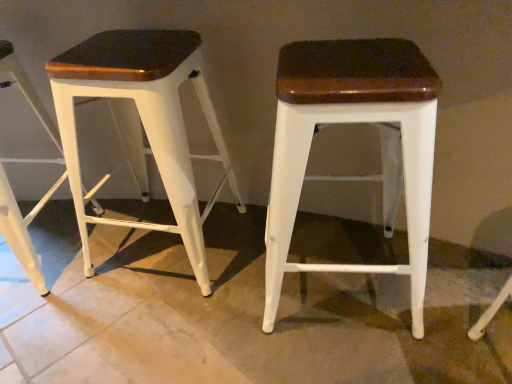
Measure the distance between matte white stool at left, which is the 1th stool from left to right, and camera.

matte white stool at left, which is the 1th stool from left to right, and camera are 3.71 feet apart.

Find the location of a particular element. Image resolution: width=512 pixels, height=384 pixels. matte white stool at center, positioned as the first stool in right-to-left order is located at coordinates (347, 123).

Can you confirm if matte white stool at left, marked as the third stool in a right-to-left arrangement, is wider than matte white stool at left, which is the second stool from right to left?

Indeed, matte white stool at left, marked as the third stool in a right-to-left arrangement, has a greater width compared to matte white stool at left, which is the second stool from right to left.

Consider the image. Considering the positions of objects matte white stool at left, marked as the third stool in a right-to-left arrangement, and matte white stool at left, which is counted as the 2th stool, starting from the left, in the image provided, who is more to the left, matte white stool at left, marked as the third stool in a right-to-left arrangement, or matte white stool at left, which is counted as the 2th stool, starting from the left,?

matte white stool at left, marked as the third stool in a right-to-left arrangement.

From a real-world perspective, is matte white stool at left, which is the 1th stool from left to right, physically above matte white stool at left, which is the second stool from right to left?

Actually, matte white stool at left, which is the 1th stool from left to right, is physically below matte white stool at left, which is the second stool from right to left, in the real world.

Consider the image. Are matte white stool at left, which is the 1th stool from left to right, and matte white stool at left, which is counted as the 2th stool, starting from the left, far apart?

They are positioned close to each other.

From the picture: Considering the sizes of objects matte white stool at center, the third stool when ordered from left to right, and matte white stool at left, which is counted as the 2th stool, starting from the left, in the image provided, who is bigger, matte white stool at center, the third stool when ordered from left to right, or matte white stool at left, which is counted as the 2th stool, starting from the left,?

matte white stool at center, the third stool when ordered from left to right, is bigger.

Could you tell me if matte white stool at center, positioned as the first stool in right-to-left order, is turned towards matte white stool at left, which is the second stool from right to left?

No, matte white stool at center, positioned as the first stool in right-to-left order, is not turned towards matte white stool at left, which is the second stool from right to left.

How many degrees apart are the facing directions of matte white stool at center, the third stool when ordered from left to right, and matte white stool at left, which is counted as the 2th stool, starting from the left?

9.35 degrees separate the facing orientations of matte white stool at center, the third stool when ordered from left to right, and matte white stool at left, which is counted as the 2th stool, starting from the left.

Considering the positions of objects matte white stool at left, which is the 1th stool from left to right, and matte white stool at center, the third stool when ordered from left to right, in the image provided, who is more to the left, matte white stool at left, which is the 1th stool from left to right, or matte white stool at center, the third stool when ordered from left to right,?

matte white stool at left, which is the 1th stool from left to right, is more to the left.

Does point (18, 230) come closer to viewer compared to point (305, 170)?

No, it is not.

Can you confirm if matte white stool at left, which is the 1th stool from left to right, is taller than matte white stool at center, positioned as the first stool in right-to-left order?

Yes.

From the image's perspective, which one is positioned higher, matte white stool at left, which is the 1th stool from left to right, or matte white stool at center, the third stool when ordered from left to right?

From the image's view, matte white stool at left, which is the 1th stool from left to right, is above.

You are a GUI agent. You are given a task and a screenshot of the screen. Output one action in this format:
    pyautogui.click(x=<x>, y=<y>)
    Task: Click on the 1st stool below when counting from the matte white stool at left, which is the second stool from right to left (from the image's perspective)
    The height and width of the screenshot is (384, 512).
    Given the screenshot: What is the action you would take?
    pyautogui.click(x=24, y=162)

Which object is positioned more to the right, matte white stool at left, which is the second stool from right to left, or matte white stool at left, marked as the third stool in a right-to-left arrangement?

matte white stool at left, which is the second stool from right to left.

Does matte white stool at left, which is the second stool from right to left, have a lesser height compared to matte white stool at left, which is the 1th stool from left to right?

In fact, matte white stool at left, which is the second stool from right to left, may be taller than matte white stool at left, which is the 1th stool from left to right.

Are matte white stool at center, positioned as the first stool in right-to-left order, and matte white stool at left, which is the 1th stool from left to right, making contact?

No, matte white stool at center, positioned as the first stool in right-to-left order, is not touching matte white stool at left, which is the 1th stool from left to right.

From the image's perspective, is matte white stool at center, the third stool when ordered from left to right, above or below matte white stool at left, which is the 1th stool from left to right?

Based on their image positions, matte white stool at center, the third stool when ordered from left to right, is located beneath matte white stool at left, which is the 1th stool from left to right.

From a real-world perspective, is matte white stool at center, the third stool when ordered from left to right, physically located above or below matte white stool at left, marked as the third stool in a right-to-left arrangement?

matte white stool at center, the third stool when ordered from left to right, is below matte white stool at left, marked as the third stool in a right-to-left arrangement.

Locate an element on the screen. stool located underneath the matte white stool at left, marked as the third stool in a right-to-left arrangement (from a real-world perspective) is located at coordinates (347, 123).

Is matte white stool at left, which is counted as the 2th stool, starting from the left, not within matte white stool at center, the third stool when ordered from left to right?

That's correct, matte white stool at left, which is counted as the 2th stool, starting from the left, is outside of matte white stool at center, the third stool when ordered from left to right.

Does point (181, 201) come in front of point (316, 46)?

That is False.

Who is shorter, matte white stool at left, which is counted as the 2th stool, starting from the left, or matte white stool at center, positioned as the first stool in right-to-left order?

With less height is matte white stool at center, positioned as the first stool in right-to-left order.

Could you tell me if matte white stool at left, which is counted as the 2th stool, starting from the left, is facing matte white stool at center, the third stool when ordered from left to right?

No, matte white stool at left, which is counted as the 2th stool, starting from the left, is not oriented towards matte white stool at center, the third stool when ordered from left to right.

You are a GUI agent. You are given a task and a screenshot of the screen. Output one action in this format:
    pyautogui.click(x=<x>, y=<y>)
    Task: Click on the stool that appears on the left of matte white stool at left, which is counted as the 2th stool, starting from the left
    The width and height of the screenshot is (512, 384).
    Given the screenshot: What is the action you would take?
    pyautogui.click(x=24, y=162)

Image resolution: width=512 pixels, height=384 pixels. In order to click on stool located on the right of matte white stool at left, which is the second stool from right to left in this screenshot , I will do `click(347, 123)`.

Looking at this image, looking at the image, which one is located further to matte white stool at left, marked as the third stool in a right-to-left arrangement, matte white stool at center, positioned as the first stool in right-to-left order, or matte white stool at left, which is the second stool from right to left?

Among the two, matte white stool at center, positioned as the first stool in right-to-left order, is located further to matte white stool at left, marked as the third stool in a right-to-left arrangement.

Estimate the real-world distances between objects in this image. Which object is further from matte white stool at center, the third stool when ordered from left to right, matte white stool at left, which is counted as the 2th stool, starting from the left, or matte white stool at left, marked as the third stool in a right-to-left arrangement?

matte white stool at left, marked as the third stool in a right-to-left arrangement, lies further to matte white stool at center, the third stool when ordered from left to right, than the other object.

In the scene shown: Looking at the image, which one is located further to matte white stool at left, marked as the third stool in a right-to-left arrangement, matte white stool at left, which is counted as the 2th stool, starting from the left, or matte white stool at center, positioned as the first stool in right-to-left order?

matte white stool at center, positioned as the first stool in right-to-left order, is further to matte white stool at left, marked as the third stool in a right-to-left arrangement.

From the image, which object appears to be farther from matte white stool at left, which is the second stool from right to left, matte white stool at left, marked as the third stool in a right-to-left arrangement, or matte white stool at center, the third stool when ordered from left to right?

matte white stool at center, the third stool when ordered from left to right, is further to matte white stool at left, which is the second stool from right to left.

When comparing their distances from matte white stool at center, the third stool when ordered from left to right, does matte white stool at left, marked as the third stool in a right-to-left arrangement, or matte white stool at left, which is the second stool from right to left, seem closer?

The object closer to matte white stool at center, the third stool when ordered from left to right, is matte white stool at left, which is the second stool from right to left.

From the image, which object appears to be farther from matte white stool at left, which is counted as the 2th stool, starting from the left, matte white stool at center, the third stool when ordered from left to right, or matte white stool at left, which is the 1th stool from left to right?

Among the two, matte white stool at center, the third stool when ordered from left to right, is located further to matte white stool at left, which is counted as the 2th stool, starting from the left.

You are a GUI agent. You are given a task and a screenshot of the screen. Output one action in this format:
    pyautogui.click(x=<x>, y=<y>)
    Task: Click on the stool between matte white stool at left, which is the 1th stool from left to right, and matte white stool at center, positioned as the first stool in right-to-left order, in the horizontal direction
    
    Given the screenshot: What is the action you would take?
    pyautogui.click(x=143, y=122)